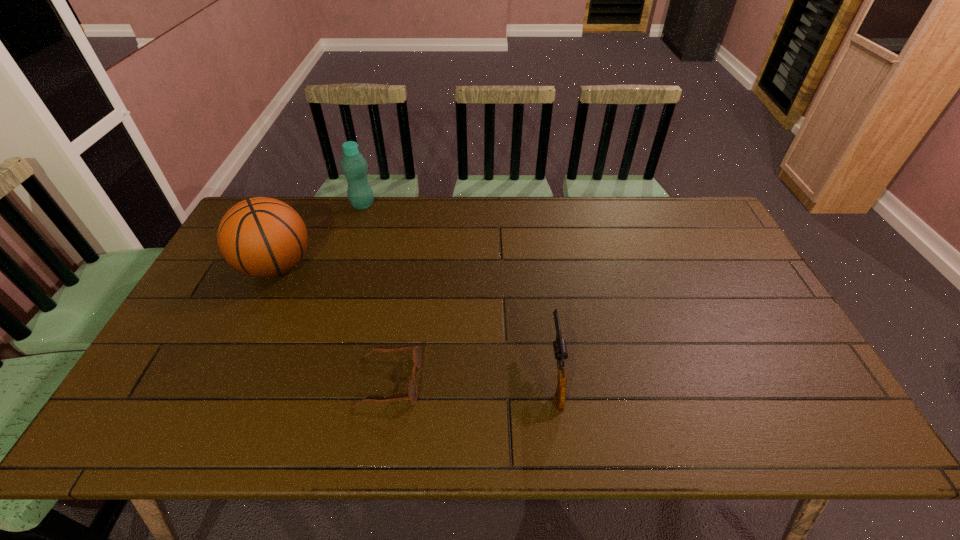
Where is `free space between the farthest object and the leftmost object`? free space between the farthest object and the leftmost object is located at coordinates (320, 235).

The image size is (960, 540). I want to click on free space between the leftmost object and the second shortest object, so click(416, 320).

Identify the location of the second closest object relative to the spectacles. (560, 349).

Image resolution: width=960 pixels, height=540 pixels. I want to click on the second closest object to the leftmost object, so click(412, 389).

I want to click on free space that satisfies the following two spatial constraints: 1. at the front cap of the farthest object; 2. on the front side of the leftmost object, so click(344, 266).

Find the location of `blank space that satisfies the following two spatial constraints: 1. at the front cap of the water bottle; 2. along the barrel of the gun`. blank space that satisfies the following two spatial constraints: 1. at the front cap of the water bottle; 2. along the barrel of the gun is located at coordinates (309, 374).